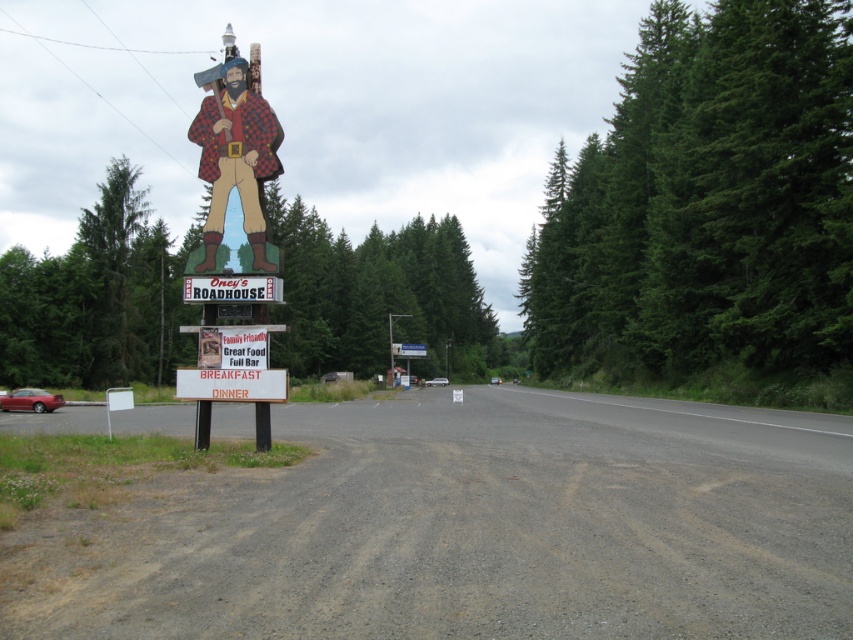
Question: Is wooden carved figure at center bigger than matte red sign at center?

Choices:
 (A) yes
 (B) no

Answer: (A)

Question: Where is wooden carved figure at center located in relation to white plastic sign at center in the image?

Choices:
 (A) below
 (B) above

Answer: (B)

Question: Which of the following is the farthest from the observer?

Choices:
 (A) (219, 132)
 (B) (189, 282)

Answer: (A)

Question: Which point is closer to the camera?

Choices:
 (A) white plastic sign at center
 (B) matte red sign at center

Answer: (B)

Question: Can you confirm if wooden carved figure at center is smaller than white plastic sign at center?

Choices:
 (A) no
 (B) yes

Answer: (A)

Question: Which point is closer to the camera?

Choices:
 (A) wooden carved figure at center
 (B) white plastic sign at center
 (C) matte red sign at center

Answer: (C)